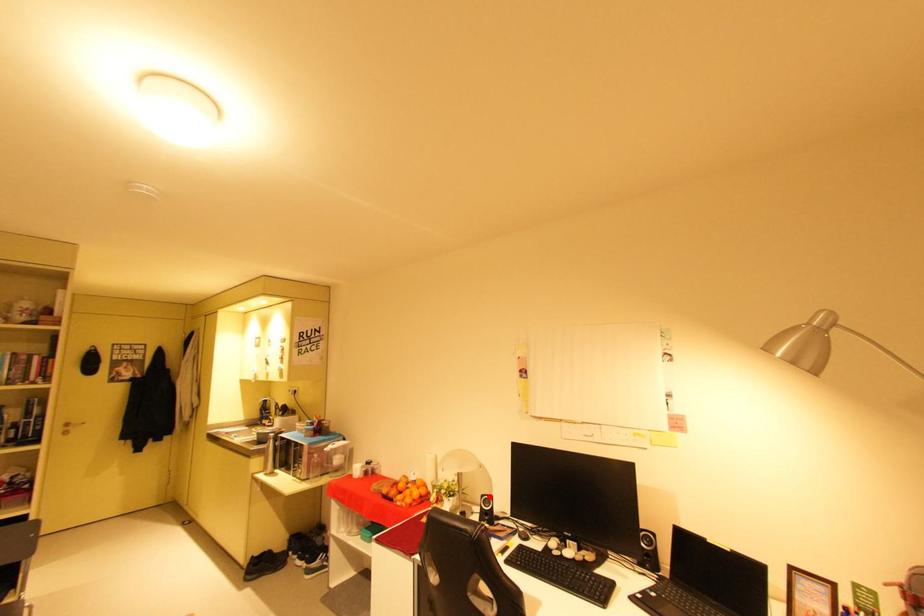
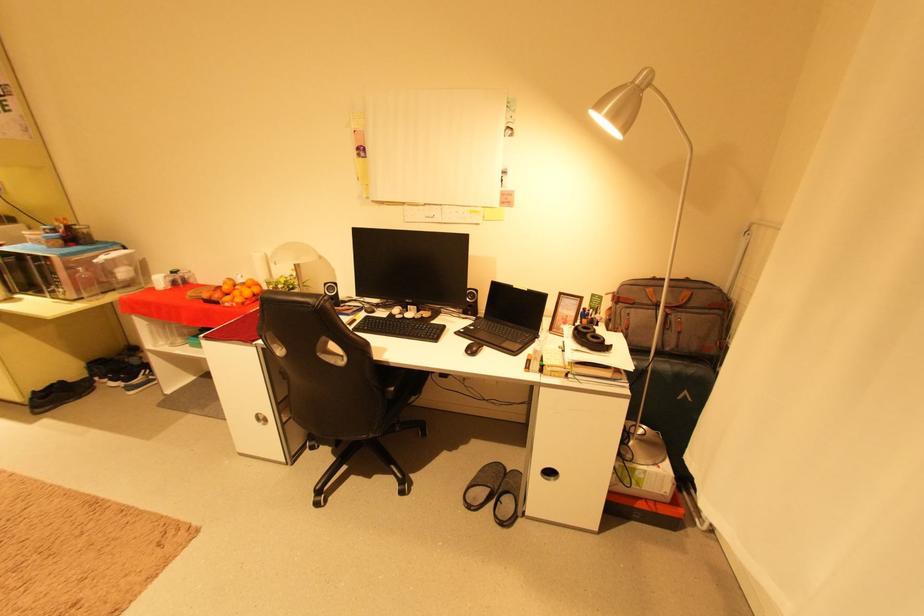
Find the pixel in the second image that matches the highlighted location in the first image.

(333, 285)